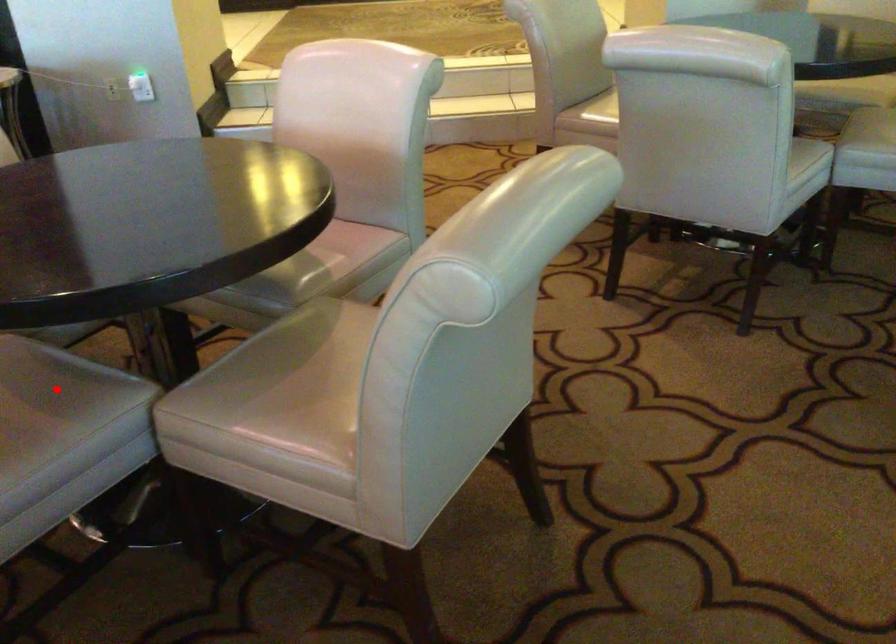
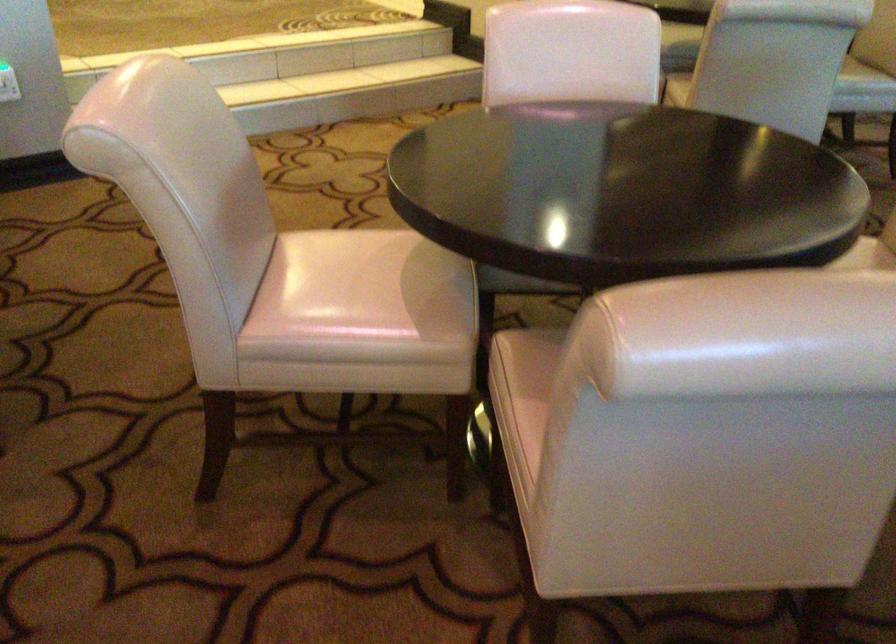
Question: I am providing you with two images of the same scene from different viewpoints. A red point is marked on the first image. Is the red point's position out of view in image 2?

Choices:
 (A) Yes
 (B) No

Answer: (A)